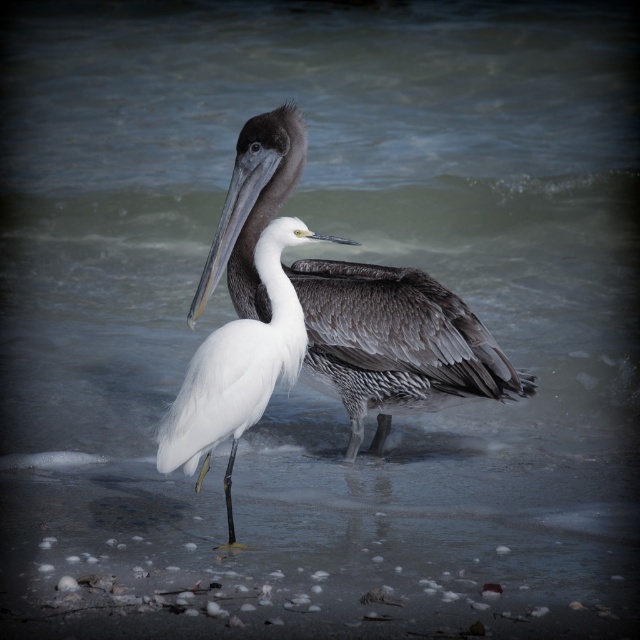
Question: Which of the following is the farthest from the observer?

Choices:
 (A) brown feathered pelican at center
 (B) white feathered bird at center

Answer: (A)

Question: Does brown feathered pelican at center appear under white feathered bird at center?

Choices:
 (A) no
 (B) yes

Answer: (A)

Question: Can you confirm if brown feathered pelican at center is bigger than white feathered bird at center?

Choices:
 (A) yes
 (B) no

Answer: (A)

Question: Among these points, which one is farthest from the camera?

Choices:
 (A) [339, 241]
 (B) [406, 330]

Answer: (B)

Question: Does brown feathered pelican at center appear on the left side of white feathered bird at center?

Choices:
 (A) no
 (B) yes

Answer: (A)

Question: Among these objects, which one is farthest from the camera?

Choices:
 (A) white feathered bird at center
 (B) brown feathered pelican at center

Answer: (B)